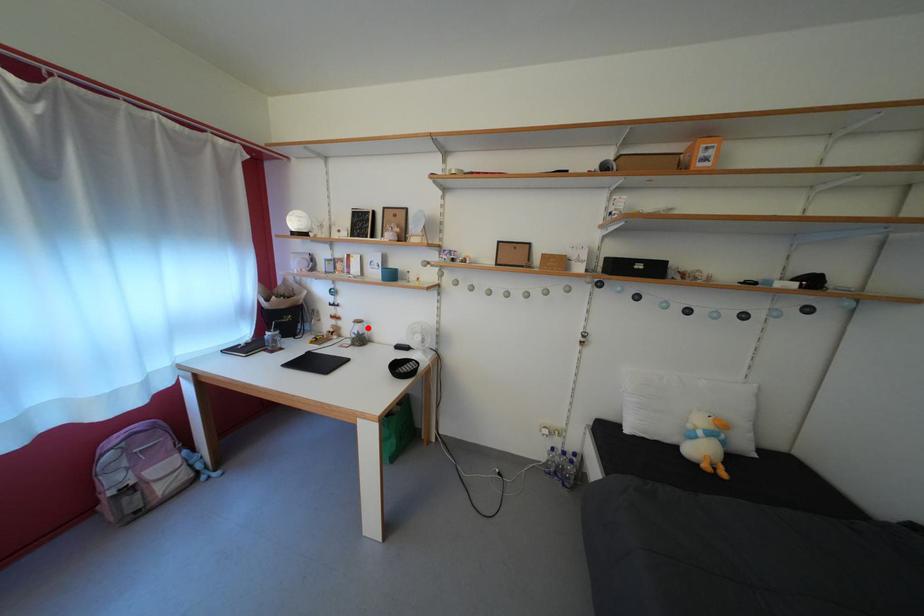
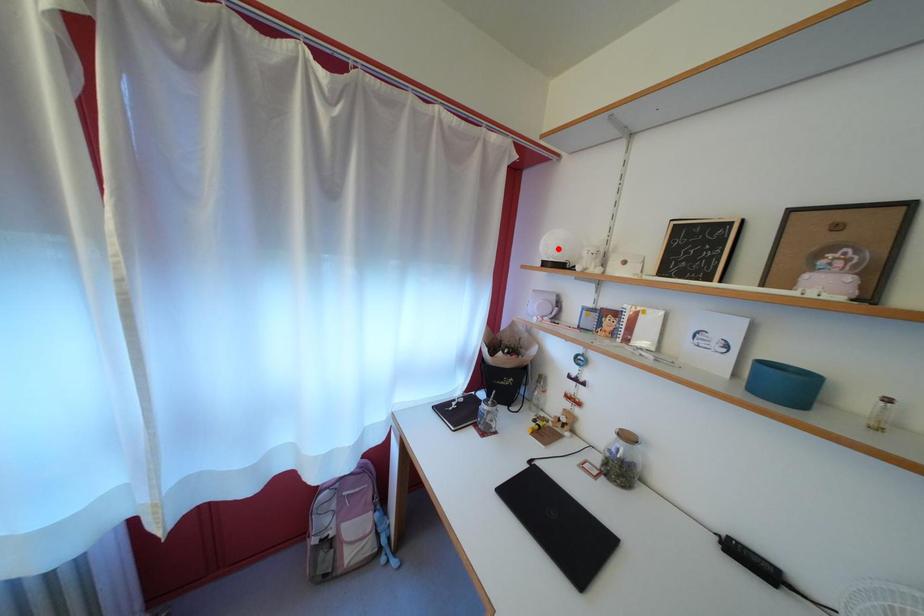
I am providing you with two images of the same scene from different viewpoints. A red point is marked on the first image and another point is marked on the second image. Does the point marked in image1 correspond to the same location as the one in image2?

No